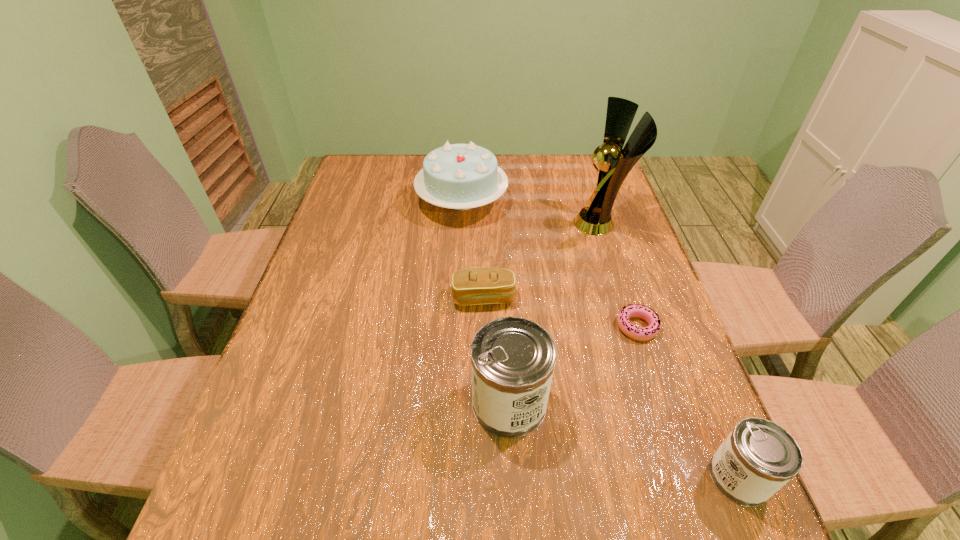
This screenshot has height=540, width=960. I want to click on vacant space located 0.340m on the left of the fifth farthest object, so click(x=306, y=403).

Locate an element on the screen. vacant space situated 0.320m on the back of the nearer can is located at coordinates (674, 320).

You are a GUI agent. You are given a task and a screenshot of the screen. Output one action in this format:
    pyautogui.click(x=<x>, y=<y>)
    Task: Click on the vacant space situated on the back of the birthday cake
    
    Given the screenshot: What is the action you would take?
    pyautogui.click(x=464, y=167)

This screenshot has height=540, width=960. Identify the location of vacant area situated 0.290m on the left of the fourth farthest object. pyautogui.click(x=494, y=327).

Locate an element on the screen. Image resolution: width=960 pixels, height=540 pixels. free space located 0.070m at the front of the award, where the globe is visible is located at coordinates (551, 223).

Find the location of a particular element. free region located at the front of the award, where the globe is visible is located at coordinates (512, 223).

Find the location of a particular element. free space located 0.110m at the front of the award, where the globe is visible is located at coordinates (538, 223).

Locate an element on the screen. This screenshot has width=960, height=540. vacant region located 0.290m on the zipper side of the second shortest object is located at coordinates (485, 420).

Image resolution: width=960 pixels, height=540 pixels. I want to click on object present at the far edge, so click(x=459, y=176).

Locate an element on the screen. This screenshot has width=960, height=540. can present at the right edge is located at coordinates (758, 457).